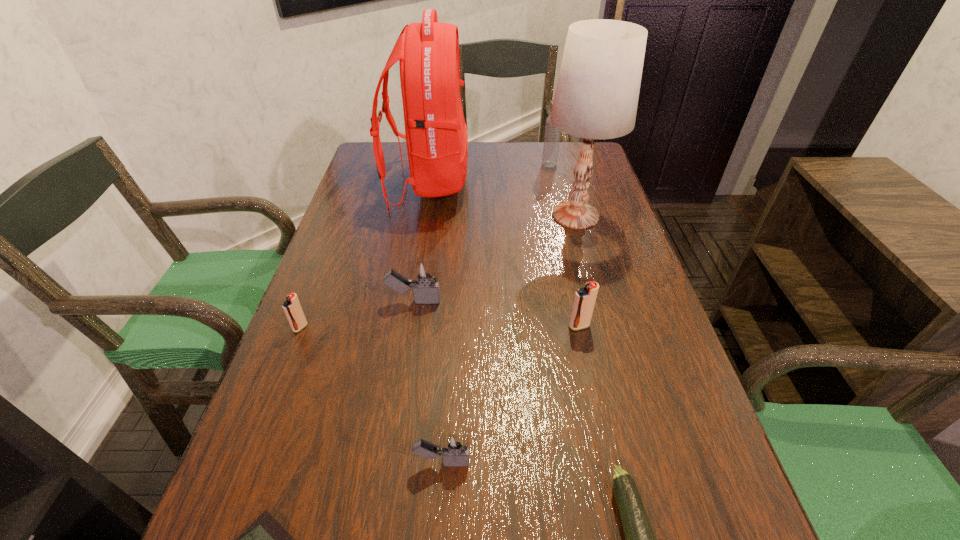
Where is `object that stands as the seventh closest to the lamp`? The image size is (960, 540). object that stands as the seventh closest to the lamp is located at coordinates (640, 539).

The image size is (960, 540). I want to click on the closest igniter to the sixth nearest object, so click(292, 308).

Image resolution: width=960 pixels, height=540 pixels. I want to click on igniter that is the nearest to the nearer gray igniter, so click(x=426, y=291).

Find the location of a particular element. vacant space that satisfies the following two spatial constraints: 1. on the front side of the left red igniter; 2. on the left side of the nearest igniter is located at coordinates (248, 462).